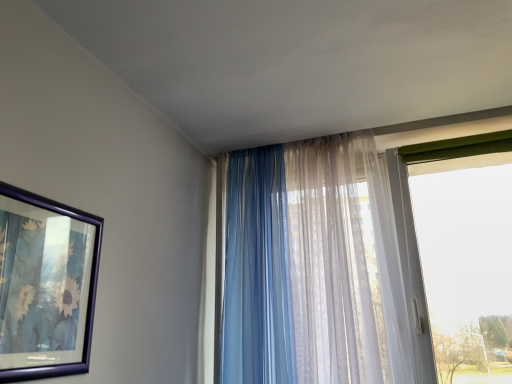
Question: Is metallic blue picture frame at left far away from translucent fabric curtain at center, which ranks as the second curtain in right-to-left order?

Choices:
 (A) no
 (B) yes

Answer: (A)

Question: Does metallic blue picture frame at left appear on the left side of translucent fabric curtain at center, the first curtain when ordered from left to right?

Choices:
 (A) yes
 (B) no

Answer: (A)

Question: From a real-world perspective, is metallic blue picture frame at left located beneath translucent fabric curtain at center, the first curtain when ordered from left to right?

Choices:
 (A) yes
 (B) no

Answer: (A)

Question: From a real-world perspective, is metallic blue picture frame at left on top of translucent fabric curtain at center, the first curtain when ordered from left to right?

Choices:
 (A) yes
 (B) no

Answer: (B)

Question: Considering the relative sizes of metallic blue picture frame at left and translucent fabric curtain at center, the first curtain when ordered from left to right, in the image provided, is metallic blue picture frame at left bigger than translucent fabric curtain at center, the first curtain when ordered from left to right,?

Choices:
 (A) yes
 (B) no

Answer: (B)

Question: Is metallic blue picture frame at left not inside translucent fabric curtain at center, the first curtain when ordered from left to right?

Choices:
 (A) no
 (B) yes

Answer: (B)

Question: Does translucent sheer curtain at right, the 1th curtain viewed from the right, have a greater width compared to metallic blue picture frame at left?

Choices:
 (A) no
 (B) yes

Answer: (B)

Question: Is translucent sheer curtain at right, which is the second curtain in left-to-right order, positioned behind metallic blue picture frame at left?

Choices:
 (A) yes
 (B) no

Answer: (A)

Question: Is translucent sheer curtain at right, which is the second curtain in left-to-right order, positioned with its back to metallic blue picture frame at left?

Choices:
 (A) yes
 (B) no

Answer: (B)

Question: Considering the relative sizes of translucent sheer curtain at right, which is the second curtain in left-to-right order, and metallic blue picture frame at left in the image provided, is translucent sheer curtain at right, which is the second curtain in left-to-right order, shorter than metallic blue picture frame at left?

Choices:
 (A) no
 (B) yes

Answer: (A)

Question: Would you say metallic blue picture frame at left is part of translucent sheer curtain at right, the 1th curtain viewed from the right,'s contents?

Choices:
 (A) yes
 (B) no

Answer: (B)

Question: Is translucent sheer curtain at right, the 1th curtain viewed from the right, not close to metallic blue picture frame at left?

Choices:
 (A) no
 (B) yes

Answer: (A)

Question: Does metallic blue picture frame at left have a greater height compared to translucent sheer curtain at right, the 1th curtain viewed from the right?

Choices:
 (A) no
 (B) yes

Answer: (A)